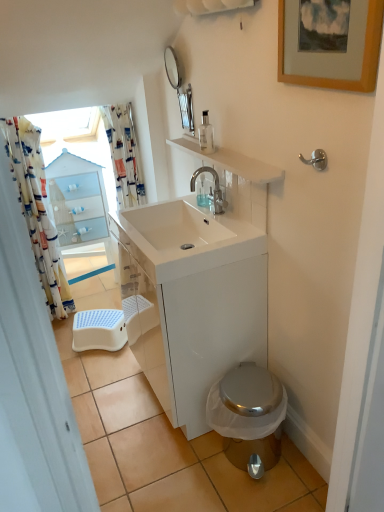
Question: Are wooden picture frame at upper right and printed fabric shower curtain at upper left, the first shower curtain from the right, far apart?

Choices:
 (A) no
 (B) yes

Answer: (B)

Question: Is printed fabric shower curtain at upper left, positioned as the 2th shower curtain in left-to-right order, completely or partially inside wooden picture frame at upper right?

Choices:
 (A) no
 (B) yes

Answer: (A)

Question: Can you confirm if wooden picture frame at upper right is positioned to the right of printed fabric shower curtain at upper left, positioned as the 2th shower curtain in left-to-right order?

Choices:
 (A) no
 (B) yes

Answer: (B)

Question: Does wooden picture frame at upper right lie in front of printed fabric shower curtain at upper left, the first shower curtain from the right?

Choices:
 (A) yes
 (B) no

Answer: (A)

Question: Is wooden picture frame at upper right oriented away from printed fabric shower curtain at upper left, positioned as the 2th shower curtain in left-to-right order?

Choices:
 (A) yes
 (B) no

Answer: (B)

Question: Is white glossy cabinet at center spatially inside printed fabric shower curtain at upper left, positioned as the 2th shower curtain in left-to-right order, or outside of it?

Choices:
 (A) outside
 (B) inside

Answer: (A)

Question: Is point (240, 236) closer or farther from the camera than point (124, 165)?

Choices:
 (A) closer
 (B) farther

Answer: (A)

Question: From the image's perspective, is white glossy cabinet at center above or below printed fabric shower curtain at upper left, the first shower curtain from the right?

Choices:
 (A) above
 (B) below

Answer: (B)

Question: Relative to printed fabric shower curtain at upper left, positioned as the 2th shower curtain in left-to-right order, is white glossy cabinet at center in front or behind?

Choices:
 (A) front
 (B) behind

Answer: (A)

Question: Is point (132, 203) closer or farther from the camera than point (89, 201)?

Choices:
 (A) farther
 (B) closer

Answer: (B)

Question: Considering the positions of printed fabric shower curtain at upper left, positioned as the 2th shower curtain in left-to-right order, and white glossy cabinet at upper left in the image, is printed fabric shower curtain at upper left, positioned as the 2th shower curtain in left-to-right order, taller or shorter than white glossy cabinet at upper left?

Choices:
 (A) tall
 (B) short

Answer: (B)

Question: Would you say printed fabric shower curtain at upper left, positioned as the 2th shower curtain in left-to-right order, is to the left or to the right of white glossy cabinet at upper left in the picture?

Choices:
 (A) left
 (B) right

Answer: (B)

Question: Is printed fabric shower curtain at upper left, the first shower curtain from the right, in front of or behind white glossy cabinet at upper left in the image?

Choices:
 (A) front
 (B) behind

Answer: (A)

Question: Based on their sizes in the image, would you say blue plastic step stool at lower left is bigger or smaller than printed fabric shower curtain at left, the 2th shower curtain in the right-to-left sequence?

Choices:
 (A) big
 (B) small

Answer: (B)

Question: In terms of height, does blue plastic step stool at lower left look taller or shorter compared to printed fabric shower curtain at left, the 1th shower curtain in the left-to-right sequence?

Choices:
 (A) short
 (B) tall

Answer: (A)